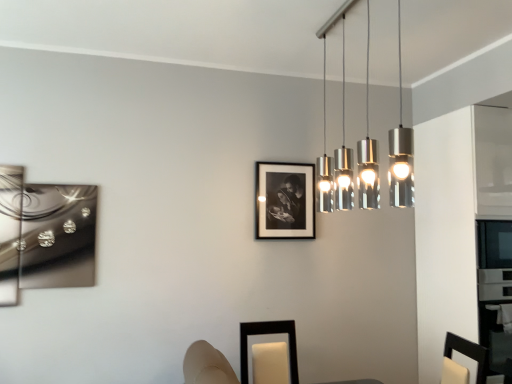
Question: From a real-world perspective, is metallic silver abstract art at left, placed as the 2th picture frame when sorted from bottom to top, located higher than black matte picture frame at lower center, acting as the 1th picture frame starting from the bottom?

Choices:
 (A) yes
 (B) no

Answer: (A)

Question: Is metallic silver abstract art at left, which is counted as the second picture frame, starting from the front, turned away from black matte picture frame at lower center, the 2th picture frame when ordered from right to left?

Choices:
 (A) yes
 (B) no

Answer: (B)

Question: Can you confirm if metallic silver abstract art at left, placed as the 2th picture frame when sorted from bottom to top, is bigger than black matte picture frame at lower center, which ranks as the third picture frame in top-to-bottom order?

Choices:
 (A) yes
 (B) no

Answer: (B)

Question: From the image's perspective, is metallic silver abstract art at left, which is the 2th picture frame in back-to-front order, beneath black matte picture frame at lower center, acting as the 1th picture frame starting from the bottom?

Choices:
 (A) yes
 (B) no

Answer: (B)

Question: Is metallic silver abstract art at left, which is counted as the second picture frame, starting from the front, far from black matte picture frame at lower center, the first picture frame positioned from the front?

Choices:
 (A) yes
 (B) no

Answer: (A)

Question: In terms of width, does black matte picture frame at lower center, the first picture frame positioned from the front, look wider or thinner when compared to silver metallic pendant lights at upper center?

Choices:
 (A) wide
 (B) thin

Answer: (A)

Question: Is black matte picture frame at lower center, the first picture frame positioned from the front, situated inside silver metallic pendant lights at upper center or outside?

Choices:
 (A) outside
 (B) inside

Answer: (A)

Question: Relative to silver metallic pendant lights at upper center, is black matte picture frame at lower center, positioned as the second picture frame in left-to-right order, in front or behind?

Choices:
 (A) front
 (B) behind

Answer: (B)

Question: Looking at the image, does black matte picture frame at lower center, which ranks as the third picture frame in top-to-bottom order, seem bigger or smaller compared to silver metallic pendant lights at upper center?

Choices:
 (A) small
 (B) big

Answer: (A)

Question: Is silver metallic pendant lights at upper center wider or thinner than metallic silver abstract art at left, which is the 2th picture frame in back-to-front order?

Choices:
 (A) thin
 (B) wide

Answer: (B)

Question: Is silver metallic pendant lights at upper center taller or shorter than metallic silver abstract art at left, arranged as the 2th picture frame when viewed from the top?

Choices:
 (A) tall
 (B) short

Answer: (A)

Question: Relative to metallic silver abstract art at left, which is counted as the second picture frame, starting from the front, is silver metallic pendant lights at upper center in front or behind?

Choices:
 (A) behind
 (B) front

Answer: (B)

Question: Is point (396, 142) positioned closer to the camera than point (50, 203)?

Choices:
 (A) closer
 (B) farther

Answer: (A)

Question: Is silver metallic pendant lights at upper center wider or thinner than black matte picture frame at lower center, positioned as the second picture frame in left-to-right order?

Choices:
 (A) thin
 (B) wide

Answer: (A)

Question: Visually, is silver metallic pendant lights at upper center positioned to the left or to the right of black matte picture frame at lower center, positioned as the second picture frame in left-to-right order?

Choices:
 (A) right
 (B) left

Answer: (A)